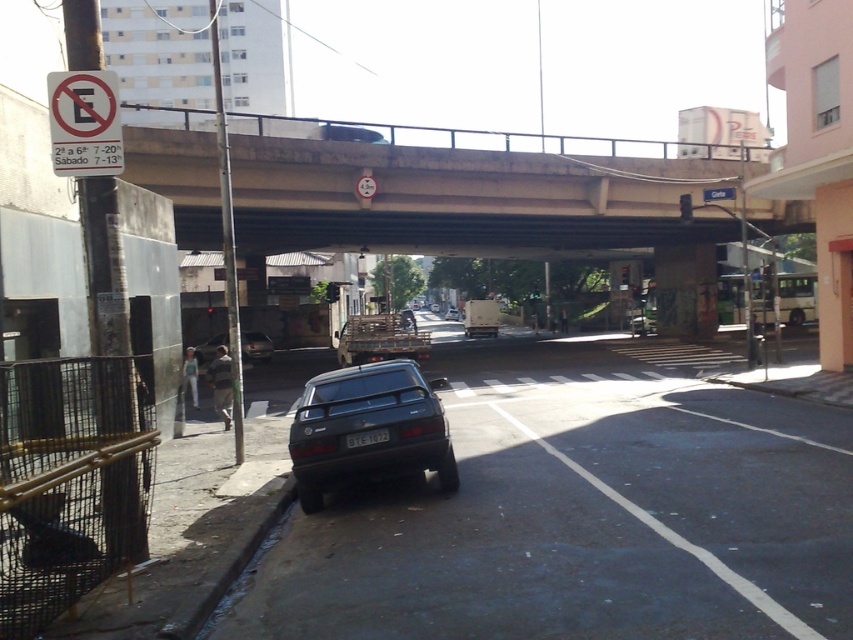
Can you confirm if glossy black car at center is positioned to the right of black plastic license plate at center?

No, glossy black car at center is not to the right of black plastic license plate at center.

From the picture: Does glossy black car at center have a lesser height compared to black plastic license plate at center?

In fact, glossy black car at center may be taller than black plastic license plate at center.

Between point (335, 392) and point (387, 429), which one is positioned behind?

The point (335, 392) is more distant.

Where is `glossy black car at center`? This screenshot has height=640, width=853. glossy black car at center is located at coordinates (368, 428).

How much distance is there between glossy black car at center and shiny black sedan at center?

They are 87.70 meters apart.

Is point (363, 381) positioned behind point (447, 312)?

No, it is in front of (447, 312).

Where is `glossy black car at center`? Image resolution: width=853 pixels, height=640 pixels. glossy black car at center is located at coordinates (368, 428).

Does matte black car at center come in front of black plastic license plate at center?

No.

Is point (245, 337) positioned in front of point (374, 438)?

That is False.

Describe the element at coordinates (254, 346) in the screenshot. I see `matte black car at center` at that location.

At what (x,y) coordinates should I click in order to perform the action: click on matte black car at center. Please return your answer as a coordinate pair (x, y). Image resolution: width=853 pixels, height=640 pixels. Looking at the image, I should click on [254, 346].